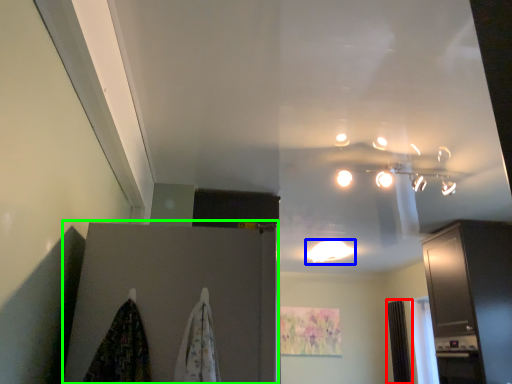
Question: Which object is the closest to the curtain (highlighted by a red box)? Choose among these: lighting (highlighted by a blue box) or door (highlighted by a green box).

Choices:
 (A) lighting
 (B) door

Answer: (A)